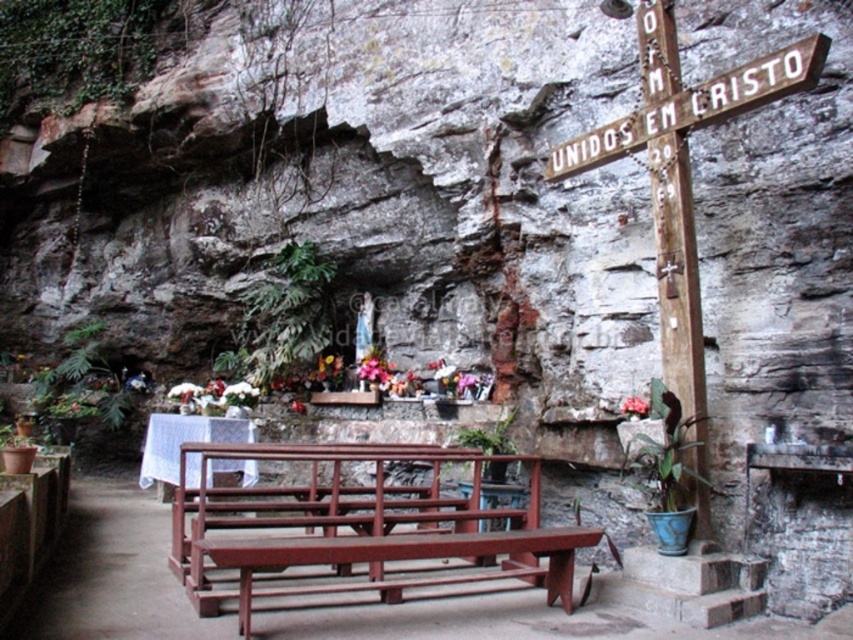
You are an explorer standing in front of the altar. You notice two wooden crosses in the scene. Which one is closer to you, the wooden cross at right or the wooden cross at upper right?

The wooden cross at right is closer to you because the wooden cross at upper right is positioned behind it.